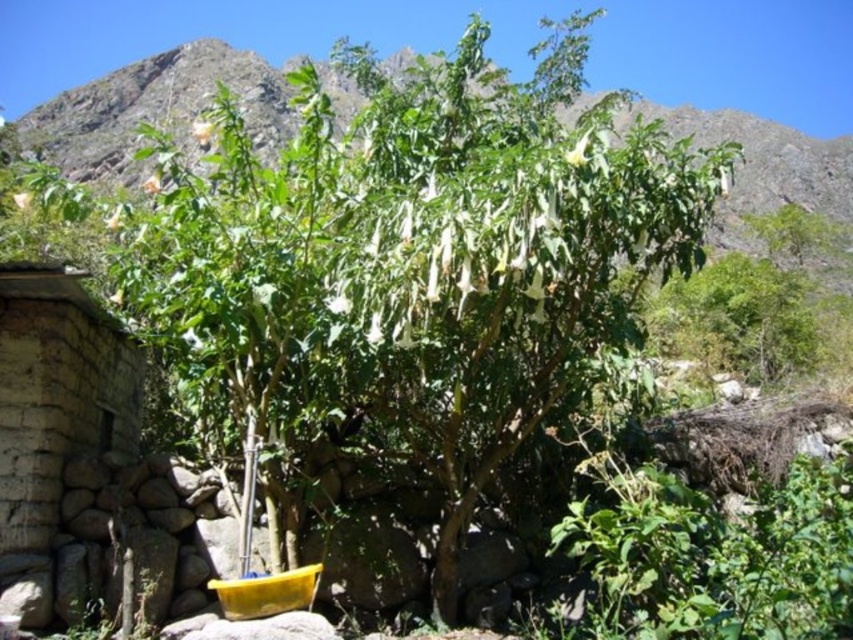
Question: In this image, where is green leafy plant at center located relative to stone wall at left?

Choices:
 (A) above
 (B) below

Answer: (A)

Question: Which of the following is the closest to the observer?

Choices:
 (A) stone wall at left
 (B) green leafy plant at center

Answer: (A)

Question: Which object is farther from the camera taking this photo?

Choices:
 (A) stone wall at left
 (B) green leafy plant at center

Answer: (B)

Question: Does green leafy plant at center appear over stone wall at left?

Choices:
 (A) yes
 (B) no

Answer: (A)

Question: Is green leafy plant at center above stone wall at left?

Choices:
 (A) no
 (B) yes

Answer: (B)